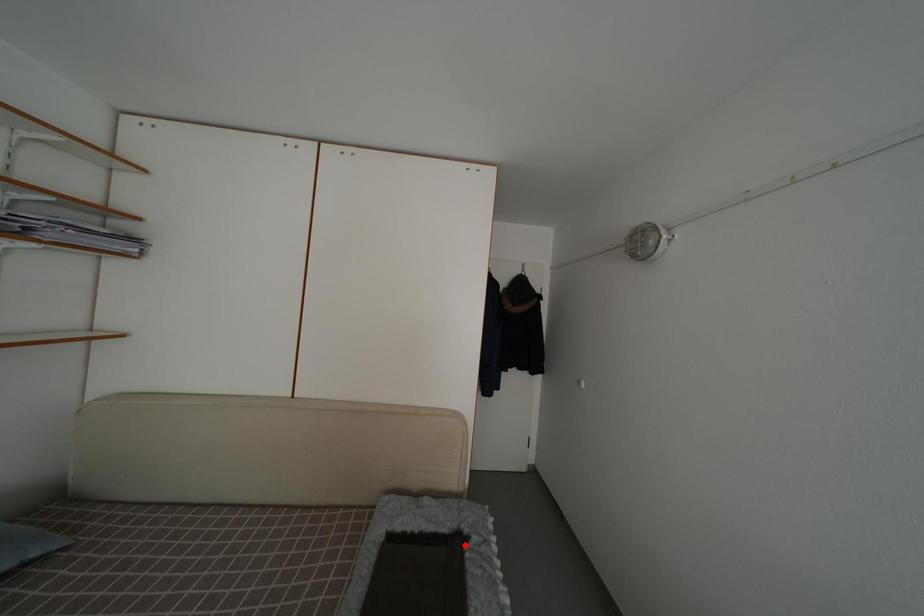
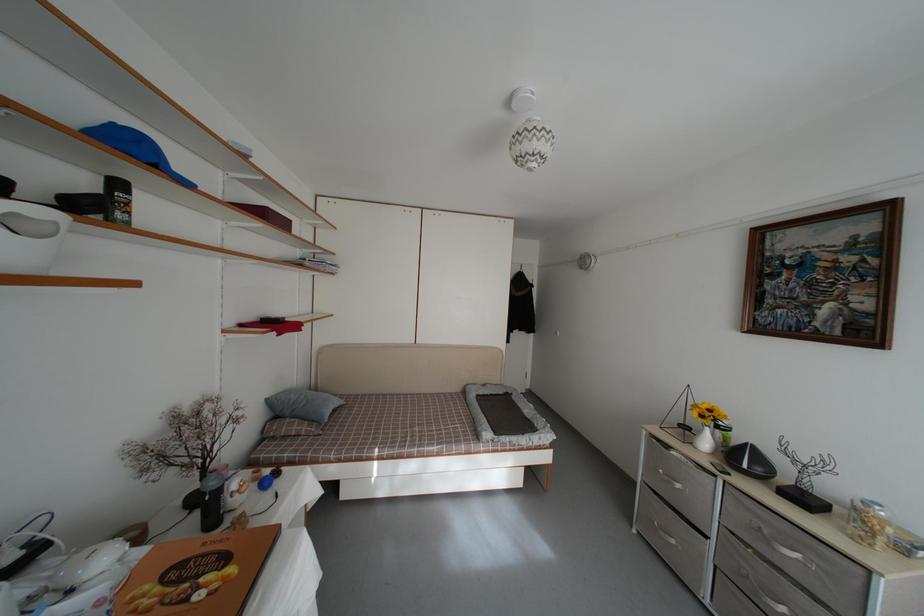
Where in the second image is the point corresponding to the highlighted location from the first image?

(513, 402)